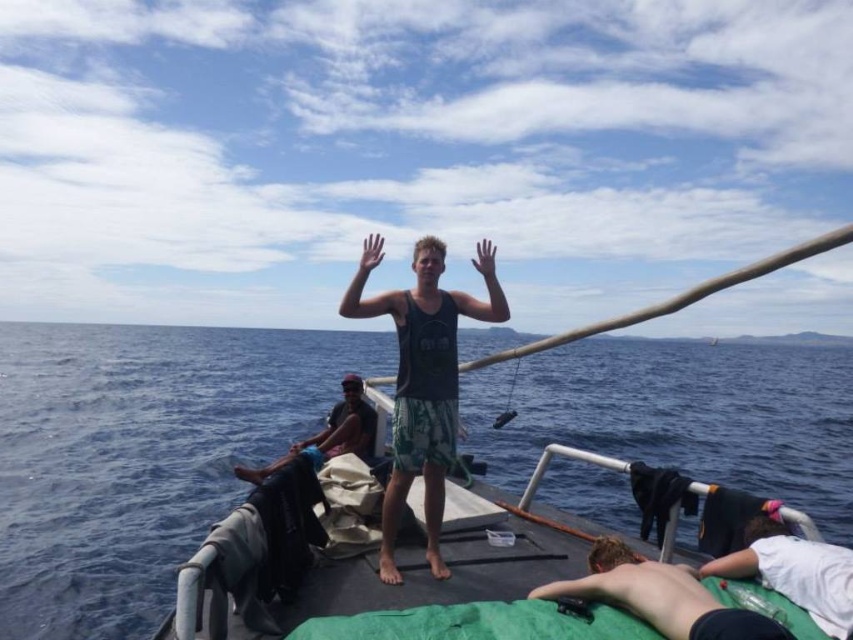
Does blue water at center have a greater height compared to shiny skin at lower right?

Yes.

The image size is (853, 640). What do you see at coordinates (138, 456) in the screenshot?
I see `blue water at center` at bounding box center [138, 456].

This screenshot has height=640, width=853. In order to click on blue water at center in this screenshot , I will do `click(138, 456)`.

Which is in front, point (444, 472) or point (606, 595)?

Point (606, 595) is more forward.

Is black matte tank top at center to the left of shiny skin at lower right from the viewer's perspective?

Indeed, black matte tank top at center is positioned on the left side of shiny skin at lower right.

Which is behind, point (436, 451) or point (688, 614)?

The point (436, 451) is more distant.

This screenshot has height=640, width=853. What are the coordinates of `black matte tank top at center` in the screenshot? It's located at click(422, 380).

Who is positioned more to the right, white cotton shirt at lower right or dark green fabric at center?

From the viewer's perspective, white cotton shirt at lower right appears more on the right side.

Does white cotton shirt at lower right have a greater height compared to dark green fabric at center?

No, white cotton shirt at lower right is not taller than dark green fabric at center.

Measure the distance between point (x=846, y=632) and camera.

Point (x=846, y=632) and camera are 3.15 meters apart.

Identify the location of white cotton shirt at lower right. (793, 572).